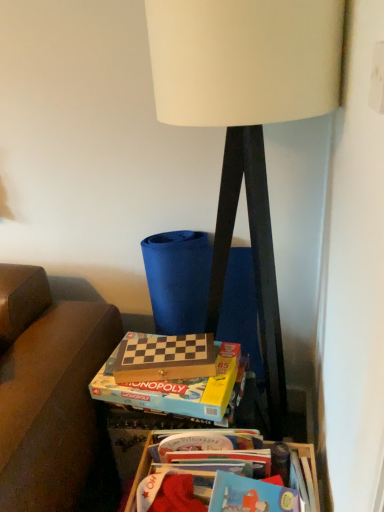
Locate an element on the screen. This screenshot has height=512, width=384. vacant area on top of wooden chess set at center, which ranks as the 2th paperback book in back-to-front order (from a real-world perspective) is located at coordinates (157, 371).